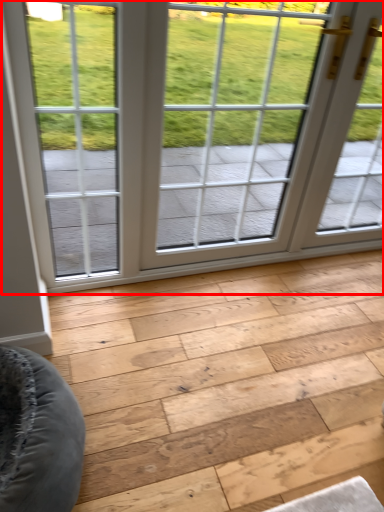
Question: From the image's perspective, where is window (annotated by the red box) located in relation to plank in the image?

Choices:
 (A) below
 (B) above

Answer: (B)